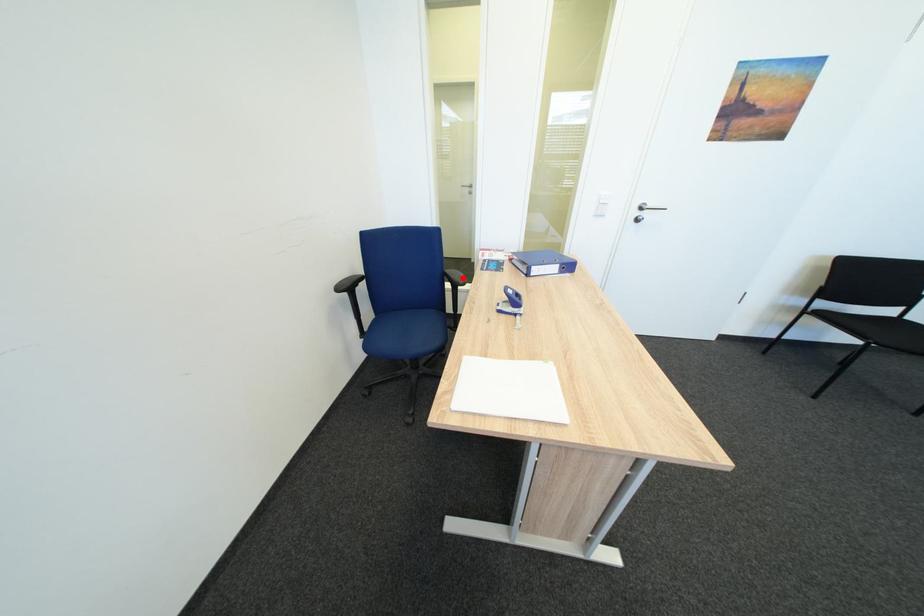
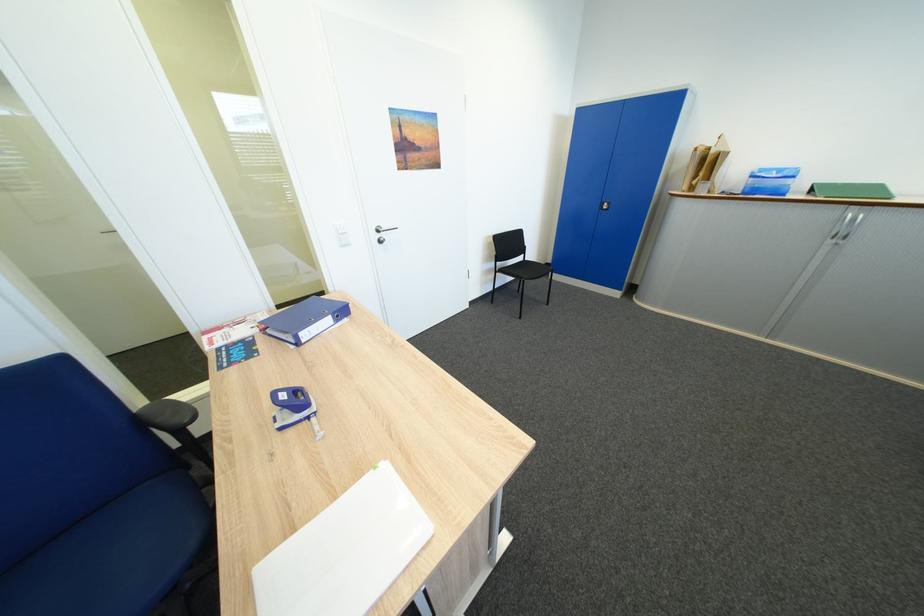
In the second image, find the point that corresponds to the highlighted location in the first image.

(169, 421)